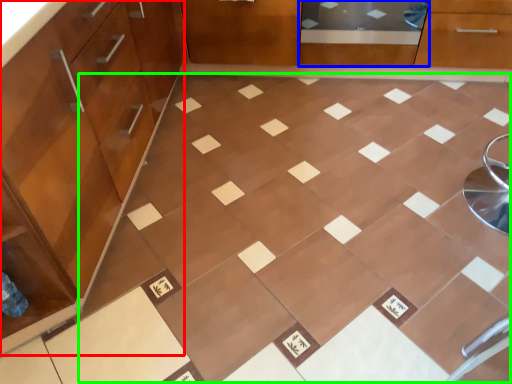
Question: Estimate the real-world distances between objects in this image. Which object is closer to cabinetry (highlighted by a red box), screen door (highlighted by a blue box) or ceramic tile (highlighted by a green box)?

Choices:
 (A) screen door
 (B) ceramic tile

Answer: (B)